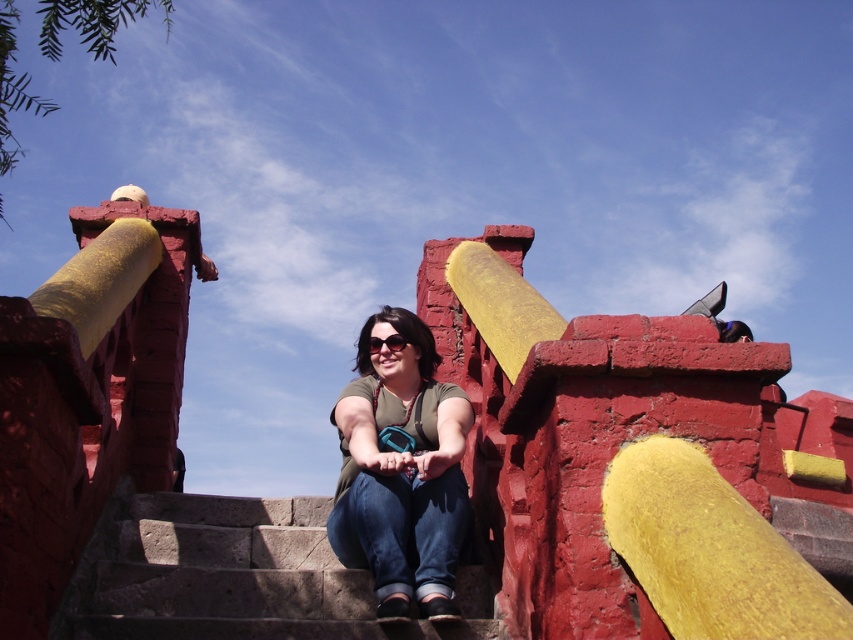
Which is above, matte green shirt at center or blue plastic goggles at center?

blue plastic goggles at center is above.

Can you confirm if matte green shirt at center is positioned below blue plastic goggles at center?

Indeed, matte green shirt at center is positioned under blue plastic goggles at center.

Is point (405, 548) positioned in front of point (397, 340)?

That is True.

Locate an element on the screen. The image size is (853, 640). matte green shirt at center is located at coordinates (401, 472).

Who is higher up, concrete stairs at center or blue plastic goggles at center?

blue plastic goggles at center

The image size is (853, 640). What do you see at coordinates (244, 577) in the screenshot?
I see `concrete stairs at center` at bounding box center [244, 577].

Image resolution: width=853 pixels, height=640 pixels. Identify the location of concrete stairs at center. (244, 577).

Is concrete stairs at center bigger than matte green shirt at center?

Actually, concrete stairs at center might be smaller than matte green shirt at center.

Is concrete stairs at center below matte green shirt at center?

Indeed, concrete stairs at center is positioned under matte green shirt at center.

Which is behind, point (90, 636) or point (386, 323)?

The point (386, 323) is more distant.

In order to click on concrete stairs at center in this screenshot , I will do `click(244, 577)`.